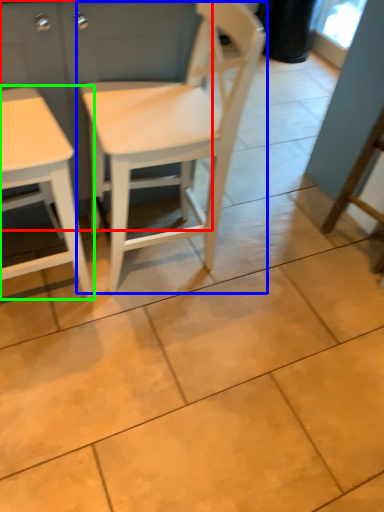
Question: Considering the real-world distances, which object is closest to dresser (highlighted by a red box)? chair (highlighted by a blue box) or table (highlighted by a green box).

Choices:
 (A) chair
 (B) table

Answer: (A)